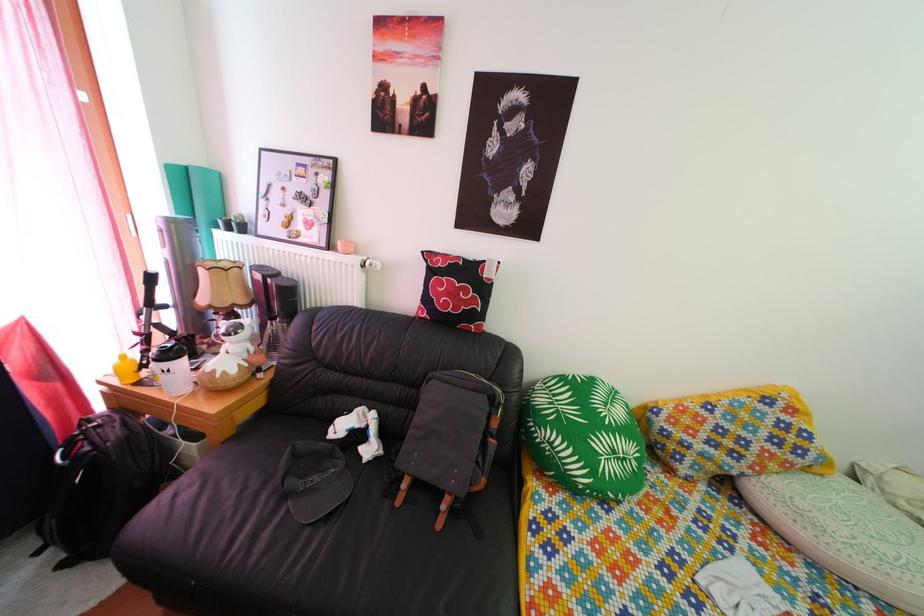
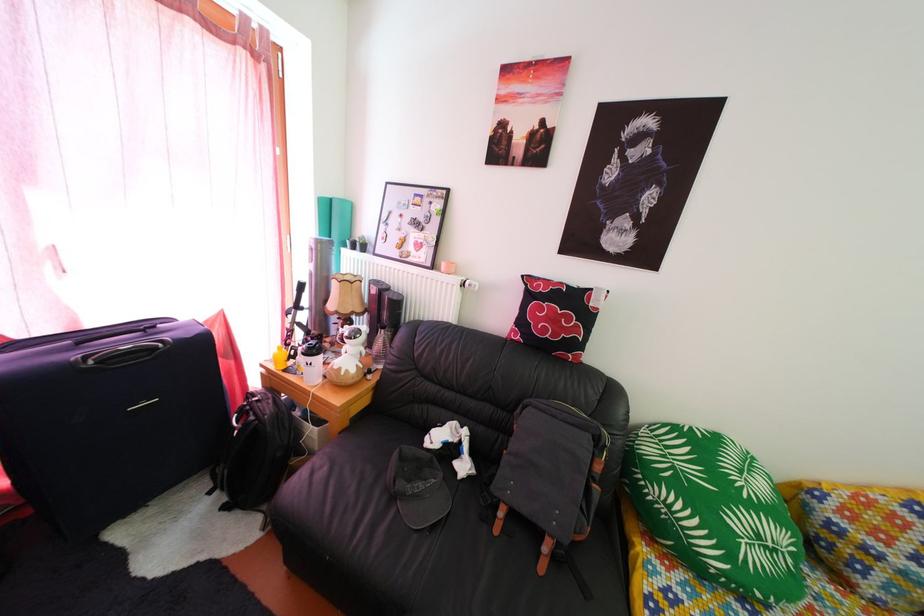
The point at (128, 382) is marked in the first image. Where is the corresponding point in the second image?

(283, 369)